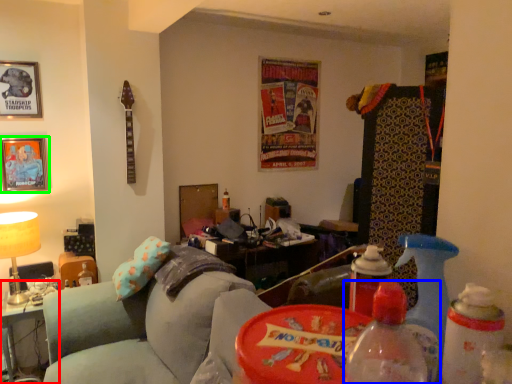
Question: Estimate the real-world distances between objects in this image. Which object is closer to table (highlighted by a red box), bottle (highlighted by a blue box) or picture frame (highlighted by a green box)?

Choices:
 (A) bottle
 (B) picture frame

Answer: (B)